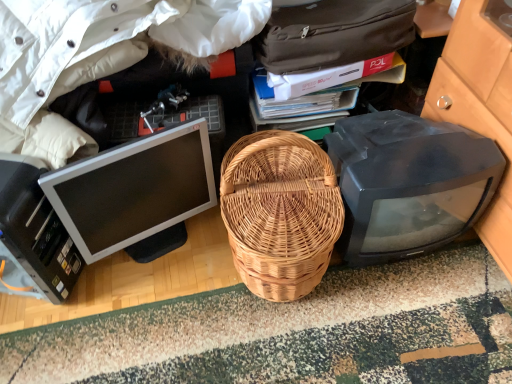
The width and height of the screenshot is (512, 384). I want to click on vacant area that is in front of natural wicker picnic basket at center, so click(x=283, y=347).